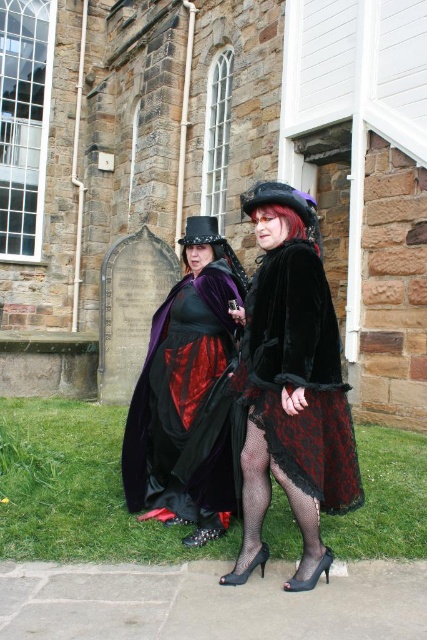
You are standing in front of the historic stone building and notice two points marked in the scene. The first point is at coordinates point (253, 204) and the second is at point (328, 356). Which of these two points is closer to you?

Point (253, 204) is closer to you because it is further to the viewer than point (328, 356).